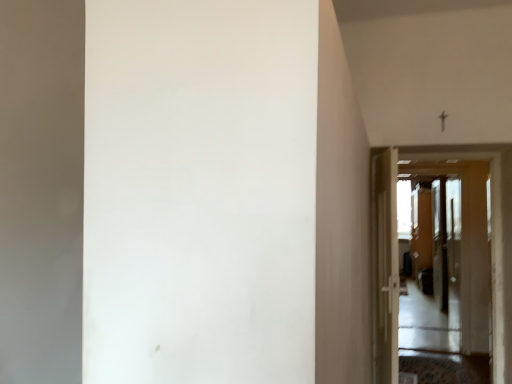
This screenshot has height=384, width=512. Identify the location of transparent plastic screen door at right, acting as the first screen door starting from the right. (422, 237).

What do you see at coordinates (461, 238) in the screenshot? I see `white glossy door at center, marked as the first door in a right-to-left arrangement` at bounding box center [461, 238].

Find the location of `transparent plastic screen door at right, positioned as the 2th screen door in front-to-back order`. transparent plastic screen door at right, positioned as the 2th screen door in front-to-back order is located at coordinates (422, 237).

Does white glossy door at right, the 2th door in the right-to-left sequence, turn towards transparent plastic screen door at right, which is the first screen door from back to front?

No, white glossy door at right, the 2th door in the right-to-left sequence, does not turn towards transparent plastic screen door at right, which is the first screen door from back to front.

How many degrees apart are the facing directions of white glossy door at right, the 2th door in the right-to-left sequence, and transparent plastic screen door at right, acting as the first screen door starting from the right?

The angular difference between white glossy door at right, the 2th door in the right-to-left sequence, and transparent plastic screen door at right, acting as the first screen door starting from the right, is 179 degrees.

Could you measure the distance between white glossy door at right, the 1th door viewed from the left, and transparent plastic screen door at right, acting as the first screen door starting from the right?

3.10 meters.

From the image's perspective, which object appears higher, white glossy door at right, the 1th door viewed from the left, or transparent plastic screen door at right, which is the first screen door from back to front?

white glossy door at right, the 1th door viewed from the left.

What are the coordinates of `door above the white glossy door at right, the 2th door in the right-to-left sequence (from the image's perspective)` in the screenshot? It's located at (461, 238).

Which object is closer to the camera taking this photo, white glossy door at right, the 1th door viewed from the left, or white glossy door at center, marked as the first door in a right-to-left arrangement?

white glossy door at right, the 1th door viewed from the left, is in front.

Is white glossy door at right, the 1th door viewed from the left, not inside white glossy door at center, marked as the first door in a right-to-left arrangement?

white glossy door at right, the 1th door viewed from the left, is positioned outside white glossy door at center, marked as the first door in a right-to-left arrangement.

From a real-world perspective, is white glossy door at right, the 1th door viewed from the left, under white glossy door at center, marked as the first door in a right-to-left arrangement?

Indeed, from a real-world perspective, white glossy door at right, the 1th door viewed from the left, is positioned beneath white glossy door at center, marked as the first door in a right-to-left arrangement.

Is transparent plastic screen door at right, which is the first screen door from back to front, not near white glossy door at center, marked as the first door in a right-to-left arrangement?

That's not correct — transparent plastic screen door at right, which is the first screen door from back to front, is a little close to white glossy door at center, marked as the first door in a right-to-left arrangement.

Is transparent plastic screen door at right, acting as the first screen door starting from the right, closer to camera compared to white glossy door at center, the second door positioned from the left?

No, it is not.

Who is bigger, transparent plastic screen door at right, positioned as the 2th screen door in front-to-back order, or white glossy door at center, the second door positioned from the left?

Bigger between the two is transparent plastic screen door at right, positioned as the 2th screen door in front-to-back order.

This screenshot has width=512, height=384. I want to click on door that is the 1st one when counting forward from the transparent plastic screen door at right, positioned as the 2th screen door in front-to-back order, so click(461, 238).

From the image's perspective, is transparent glass screen door at center, positioned as the 2th screen door in back-to-front order, positioned above or below white glossy door at center, the second door positioned from the left?

Based on their image positions, transparent glass screen door at center, positioned as the 2th screen door in back-to-front order, is located beneath white glossy door at center, the second door positioned from the left.

Are transparent glass screen door at center, which is the 2th screen door from right to left, and white glossy door at center, marked as the first door in a right-to-left arrangement, beside each other?

No, transparent glass screen door at center, which is the 2th screen door from right to left, is not next to white glossy door at center, marked as the first door in a right-to-left arrangement.

Where is `the 1st screen door to the right when counting from the white glossy door at center, the second door positioned from the left`? The image size is (512, 384). the 1st screen door to the right when counting from the white glossy door at center, the second door positioned from the left is located at coordinates (440, 277).

How many degrees apart are the facing directions of transparent glass screen door at center, which is the 2th screen door from right to left, and white glossy door at center, the second door positioned from the left?

They differ by 178 degrees in their facing directions.

Considering the points (414, 207) and (428, 257), which point is in front, point (414, 207) or point (428, 257)?

The point (428, 257) is in front.

In terms of height, does transparent glass screen door at center, the 1th screen door from the left, look taller or shorter compared to transparent plastic screen door at right, positioned as the 2th screen door in front-to-back order?

In the image, transparent glass screen door at center, the 1th screen door from the left, appears to be taller than transparent plastic screen door at right, positioned as the 2th screen door in front-to-back order.

Is transparent glass screen door at center, the 1th screen door from the left, to the left of transparent plastic screen door at right, positioned as the 2th screen door in front-to-back order, from the viewer's perspective?

Yes.

Which object is further away from the camera, transparent glass screen door at center, which is the 2th screen door from right to left, or transparent plastic screen door at right, acting as the first screen door starting from the right?

transparent plastic screen door at right, acting as the first screen door starting from the right, is behind.

Between point (417, 221) and point (421, 313), which one is positioned in front?

The point (421, 313) is more forward.

Is transparent plastic screen door at right, which is the first screen door from back to front, at the left side of transparent glass screen door at center, which is the 1th screen door from front to back?

No, transparent plastic screen door at right, which is the first screen door from back to front, is not to the left of transparent glass screen door at center, which is the 1th screen door from front to back.

From a real-world perspective, who is located lower, transparent plastic screen door at right, positioned as the 2th screen door in front-to-back order, or transparent glass screen door at center, which is the 2th screen door from right to left?

transparent plastic screen door at right, positioned as the 2th screen door in front-to-back order.

From a real-world perspective, is white glossy door at center, the second door positioned from the left, located beneath transparent glass screen door at center, which is the 2th screen door from right to left?

No, from a real-world perspective, white glossy door at center, the second door positioned from the left, is not below transparent glass screen door at center, which is the 2th screen door from right to left.

Between white glossy door at center, marked as the first door in a right-to-left arrangement, and transparent glass screen door at center, which is the 1th screen door from front to back, which one appears on the right side from the viewer's perspective?

Positioned to the right is transparent glass screen door at center, which is the 1th screen door from front to back.

From the image's perspective, which object appears higher, white glossy door at center, marked as the first door in a right-to-left arrangement, or transparent glass screen door at center, the 1th screen door from the left?

white glossy door at center, marked as the first door in a right-to-left arrangement, from the image's perspective.

Is point (475, 179) closer to camera compared to point (420, 338)?

Yes, point (475, 179) is closer to viewer.

The image size is (512, 384). There is a transparent plastic screen door at right, which is the second screen door from left to right. Find the location of `the 1st door above it (from the image's perspective)`. the 1st door above it (from the image's perspective) is located at coordinates (384, 265).

You are a GUI agent. You are given a task and a screenshot of the screen. Output one action in this format:
    pyautogui.click(x=<x>, y=<y>)
    Task: Click on the door on the right of the white glossy door at right, the 1th door viewed from the left
    
    Given the screenshot: What is the action you would take?
    pyautogui.click(x=461, y=238)

When comparing their distances from transparent glass screen door at center, which is the 2th screen door from right to left, does transparent plastic screen door at right, which is the second screen door from left to right, or white glossy door at center, marked as the first door in a right-to-left arrangement, seem further?

white glossy door at center, marked as the first door in a right-to-left arrangement, is further to transparent glass screen door at center, which is the 2th screen door from right to left.

When comparing their distances from white glossy door at right, the 1th door viewed from the left, does transparent glass screen door at center, the 1th screen door from the left, or white glossy door at center, marked as the first door in a right-to-left arrangement, seem closer?

Based on the image, white glossy door at center, marked as the first door in a right-to-left arrangement, appears to be nearer to white glossy door at right, the 1th door viewed from the left.

When comparing their distances from white glossy door at center, marked as the first door in a right-to-left arrangement, does transparent glass screen door at center, which is the 1th screen door from front to back, or transparent plastic screen door at right, positioned as the 2th screen door in front-to-back order, seem further?

The object further to white glossy door at center, marked as the first door in a right-to-left arrangement, is transparent plastic screen door at right, positioned as the 2th screen door in front-to-back order.

Based on their spatial positions, is white glossy door at right, the 1th door viewed from the left, or transparent glass screen door at center, which is the 1th screen door from front to back, further from transparent plastic screen door at right, positioned as the 2th screen door in front-to-back order?

white glossy door at right, the 1th door viewed from the left, is further to transparent plastic screen door at right, positioned as the 2th screen door in front-to-back order.

Estimate the real-world distances between objects in this image. Which object is further from white glossy door at right, the 2th door in the right-to-left sequence, transparent glass screen door at center, which is the 2th screen door from right to left, or transparent plastic screen door at right, which is the second screen door from left to right?

The object further to white glossy door at right, the 2th door in the right-to-left sequence, is transparent plastic screen door at right, which is the second screen door from left to right.

Based on their spatial positions, is white glossy door at right, the 1th door viewed from the left, or white glossy door at center, marked as the first door in a right-to-left arrangement, closer to transparent glass screen door at center, the 1th screen door from the left?

white glossy door at center, marked as the first door in a right-to-left arrangement, is positioned closer to the anchor transparent glass screen door at center, the 1th screen door from the left.

Which object lies further to the anchor point white glossy door at right, the 1th door viewed from the left, transparent plastic screen door at right, positioned as the 2th screen door in front-to-back order, or transparent glass screen door at center, which is the 2th screen door from right to left?

transparent plastic screen door at right, positioned as the 2th screen door in front-to-back order, is positioned further to the anchor white glossy door at right, the 1th door viewed from the left.

From the image, which object appears to be farther from white glossy door at center, the second door positioned from the left, white glossy door at right, the 1th door viewed from the left, or transparent plastic screen door at right, which is the second screen door from left to right?

white glossy door at right, the 1th door viewed from the left, is positioned further to the anchor white glossy door at center, the second door positioned from the left.

The width and height of the screenshot is (512, 384). Identify the location of screen door between white glossy door at center, the second door positioned from the left, and transparent plastic screen door at right, acting as the first screen door starting from the right, from front to back. (440, 277).

This screenshot has width=512, height=384. I want to click on door between white glossy door at right, the 2th door in the right-to-left sequence, and transparent glass screen door at center, the 1th screen door from the left, from front to back, so click(x=461, y=238).

What are the coordinates of `screen door between white glossy door at right, the 2th door in the right-to-left sequence, and transparent plastic screen door at right, which is the second screen door from left to right, along the z-axis` in the screenshot? It's located at (440, 277).

Locate an element on the screen. door positioned between white glossy door at right, the 1th door viewed from the left, and transparent plastic screen door at right, which is the first screen door from back to front, from near to far is located at coordinates (461, 238).